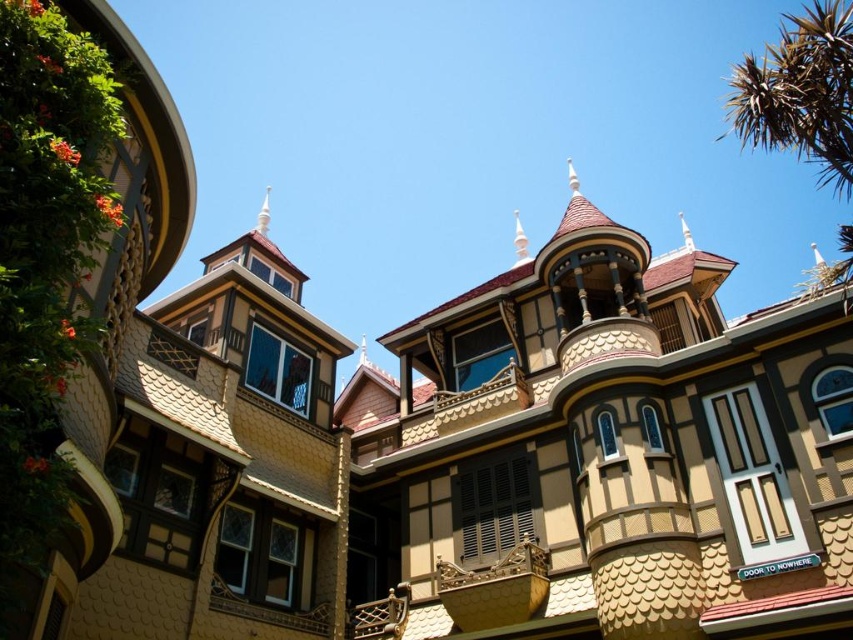
You are a painter standing at the base of the Victorian house. You need to paint both the beige scalloped siding at center and the green spiky leaves at upper right. Which object will require you to climb higher on the ladder?

The green spiky leaves at upper right will require climbing higher on the ladder because they are taller than the beige scalloped siding at center.

You are a drone operator trying to capture aerial footage of the Victorian house. Your drone has a maximum flight range of 100 feet. If you are positioned at the beige scalloped siding at center, can your drone reach the green spiky leaves at upper right without exceeding its range?

The distance between the beige scalloped siding at center and the green spiky leaves at upper right is 99.37 feet, which is within the drone operator drone operator maximum flight range of 100 feet. Therefore, the drone can reach the green spiky leaves at upper right without exceeding its range.

Looking at the Victorian house, where is the beige scalloped siding at center in relation to the green spiky leaves at upper right?

The beige scalloped siding at center is to the left of the green spiky leaves at upper right.